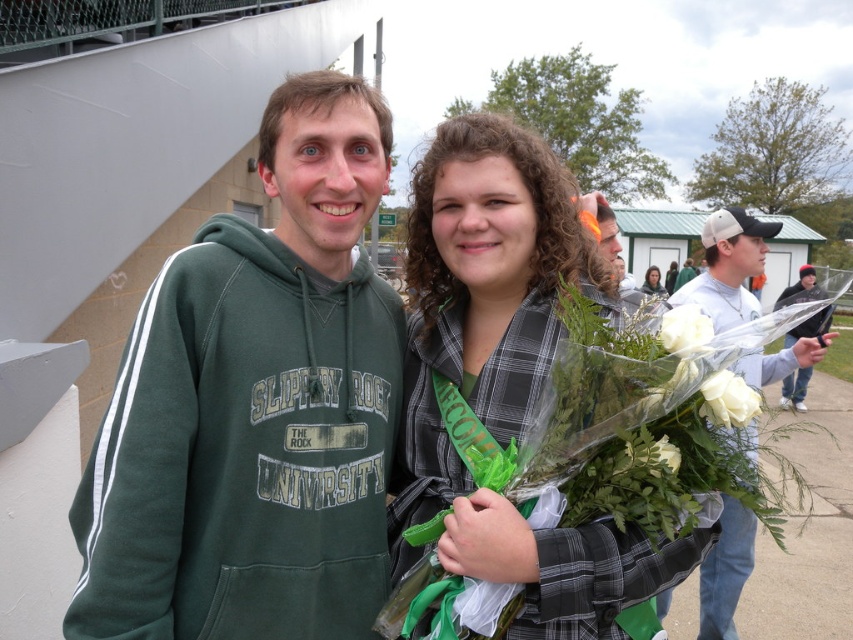
Which is more to the left, green hoodie at left or white matte bouquet at center?

From the viewer's perspective, green hoodie at left appears more on the left side.

Who is more forward, (160, 288) or (666, 452)?

Point (666, 452)

What do you see at coordinates (254, 406) in the screenshot? This screenshot has height=640, width=853. I see `green hoodie at left` at bounding box center [254, 406].

At what (x,y) coordinates should I click in order to perform the action: click on green hoodie at left. Please return your answer as a coordinate pair (x, y). Image resolution: width=853 pixels, height=640 pixels. Looking at the image, I should click on (254, 406).

Does green hoodie at left have a lesser width compared to green plaid shirt at center?

Indeed, green hoodie at left has a lesser width compared to green plaid shirt at center.

Who is lower down, green hoodie at left or green plaid shirt at center?

green hoodie at left is below.

Which is behind, point (160, 408) or point (564, 260)?

The point (564, 260) is more distant.

Where is `green hoodie at left`? green hoodie at left is located at coordinates (254, 406).

Which is more to the left, green plaid shirt at center or white matte bouquet at center?

From the viewer's perspective, green plaid shirt at center appears more on the left side.

Does green plaid shirt at center appear on the right side of white matte bouquet at center?

In fact, green plaid shirt at center is to the left of white matte bouquet at center.

Find the location of `green plaid shirt at center`. green plaid shirt at center is located at coordinates (506, 378).